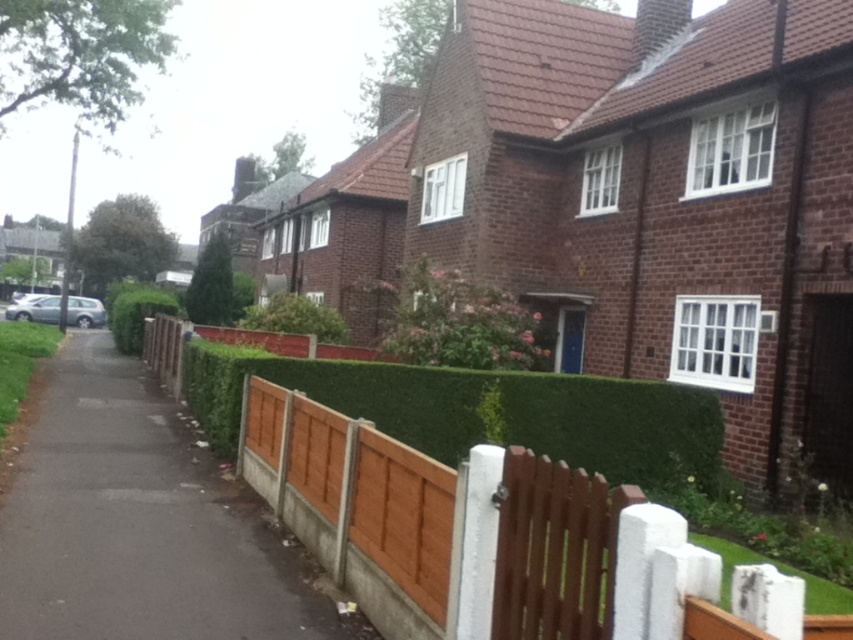
Can you confirm if brown wooden fence at center is smaller than brown wooden fence at lower center?

Actually, brown wooden fence at center might be larger than brown wooden fence at lower center.

How far apart are brown wooden fence at center and brown wooden fence at lower center?

brown wooden fence at center and brown wooden fence at lower center are 21.66 inches apart.

Is point (405, 492) closer to camera compared to point (83, 508)?

Yes, point (405, 492) is in front of point (83, 508).

Image resolution: width=853 pixels, height=640 pixels. Find the location of `brown wooden fence at center`. brown wooden fence at center is located at coordinates (480, 536).

Which of these two, brown wooden fence at lower center or green hedge at center, stands taller?

Standing taller between the two is green hedge at center.

Can you confirm if brown wooden fence at lower center is positioned to the left of green hedge at center?

No, brown wooden fence at lower center is not to the left of green hedge at center.

The width and height of the screenshot is (853, 640). I want to click on brown wooden fence at lower center, so click(x=143, y=524).

This screenshot has height=640, width=853. In order to click on brown wooden fence at lower center in this screenshot , I will do point(143,524).

Between point (309, 417) and point (155, 308), which one is positioned in front?

Positioned in front is point (309, 417).

Who is higher up, brown wooden fence at center or green hedge at center?

green hedge at center is higher up.

This screenshot has width=853, height=640. Describe the element at coordinates (480, 536) in the screenshot. I see `brown wooden fence at center` at that location.

Find the location of a particular element. brown wooden fence at center is located at coordinates (480, 536).